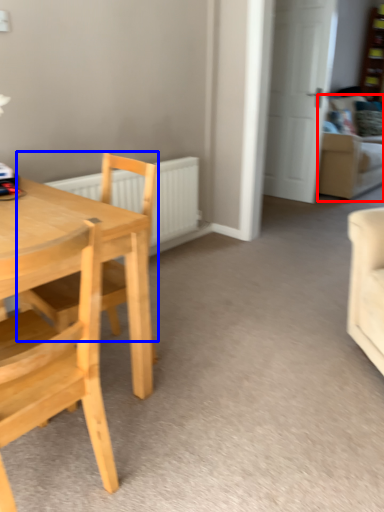
Question: Which point is further to the camera, couch (highlighted by a red box) or chair (highlighted by a blue box)?

Choices:
 (A) couch
 (B) chair

Answer: (A)